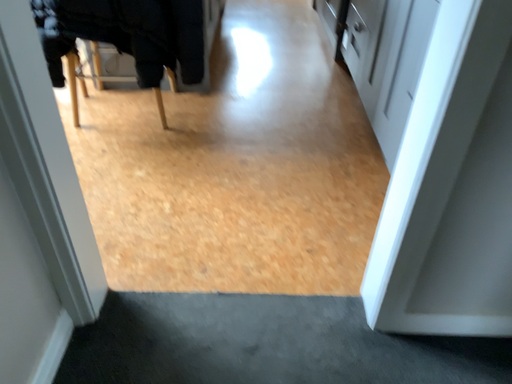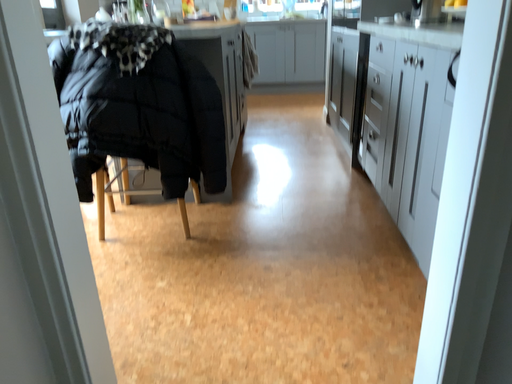
Question: How did the camera likely rotate when shooting the video?

Choices:
 (A) rotated downward
 (B) rotated upward

Answer: (B)